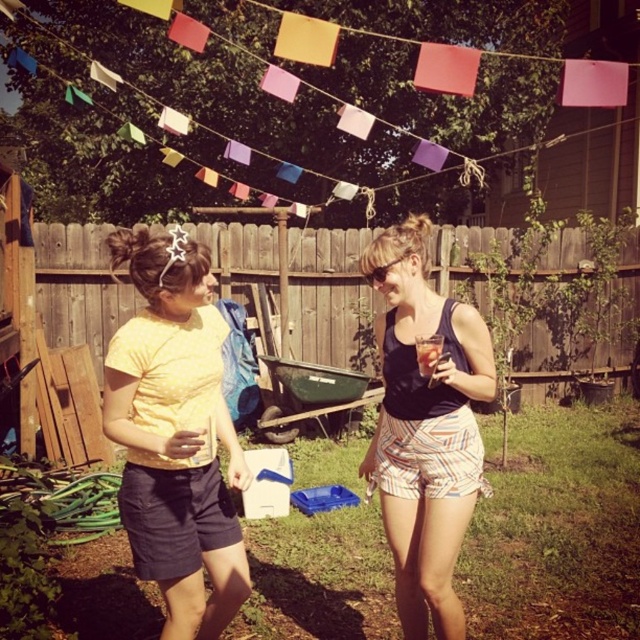
Based on the photo, you are a photographer trying to capture a clear shot of the yellow dotted shirt at center without any obstructions. Based on the scene, can you position yourself in a way to avoid the colorful paper flags at upper center blocking the view?

The yellow dotted shirt at center is behind the colorful paper flags at upper center, so moving your position to either side or adjusting the angle might allow you to see the yellow dotted shirt at center without the flags blocking the view.

From the picture: You are planning to hang a new decoration in the backyard. The colorful paper flags at upper center and the matte black tank top at center are already present. Which object would cast a bigger shadow if the sun is directly above them?

The colorful paper flags at upper center would cast a bigger shadow because they are larger in size than the matte black tank top at center.

Looking at this image, you are standing in the backyard and want to place a small potted plant between the two points, point (132, 268) and point (468, 424). Which point should you place it closer to if you want the plant to be more visible to someone approaching from the front?

You should place the potted plant closer to point (132, 268) since it is closer to the viewer, making it more visible to someone approaching from the front.